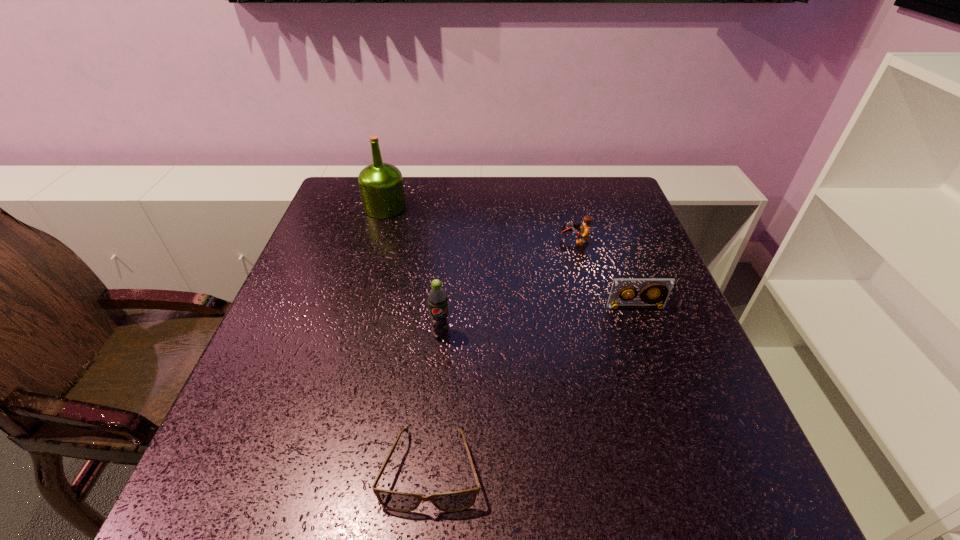
You are a GUI agent. You are given a task and a screenshot of the screen. Output one action in this format:
    pyautogui.click(x=<x>, y=<y>)
    Task: Click on the vacant space at the far edge of the desktop
    The height and width of the screenshot is (540, 960).
    Given the screenshot: What is the action you would take?
    pyautogui.click(x=537, y=220)

Image resolution: width=960 pixels, height=540 pixels. In the image, there is a desktop. In order to click on free space at the near edge in this screenshot , I will do `click(419, 519)`.

Where is `free space at the left edge of the desktop`? The height and width of the screenshot is (540, 960). free space at the left edge of the desktop is located at coordinates [x=300, y=327].

Where is `vacant space at the right edge of the desktop`? The width and height of the screenshot is (960, 540). vacant space at the right edge of the desktop is located at coordinates (693, 440).

Identify the location of free location at the far left corner of the desktop. (x=359, y=195).

Locate an element on the screen. free region at the far right corner of the desktop is located at coordinates (578, 197).

The height and width of the screenshot is (540, 960). I want to click on free spot between the tallest object and the videotape, so click(511, 257).

The image size is (960, 540). Identify the location of free space between the third farthest object and the second nearest object. (539, 321).

This screenshot has width=960, height=540. Identify the location of empty space between the fourth nearest object and the fourth farthest object. (508, 288).

You are a GUI agent. You are given a task and a screenshot of the screen. Output one action in this format:
    pyautogui.click(x=<x>, y=<y>)
    Task: Click on the free space between the third nearest object and the fourth farthest object
    
    Given the screenshot: What is the action you would take?
    pyautogui.click(x=539, y=321)